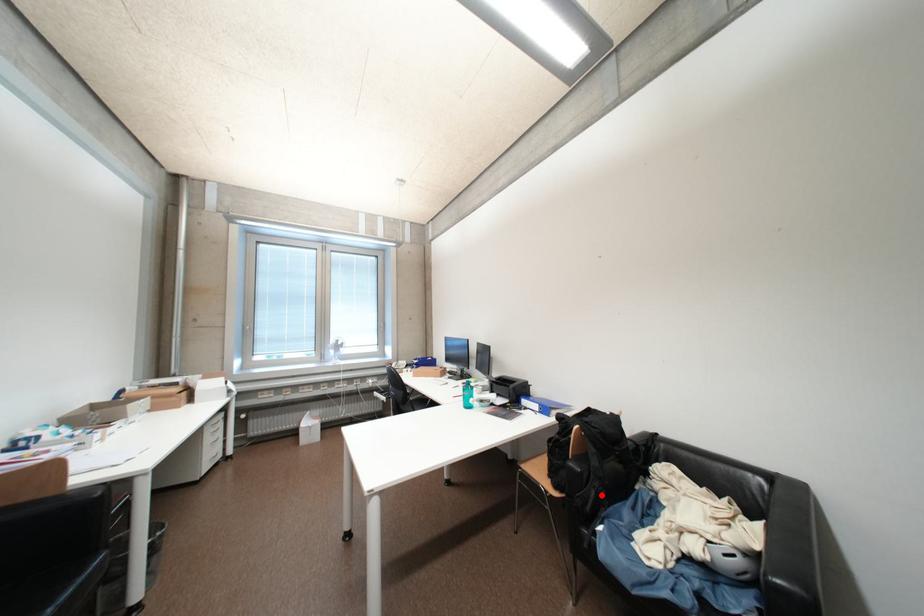
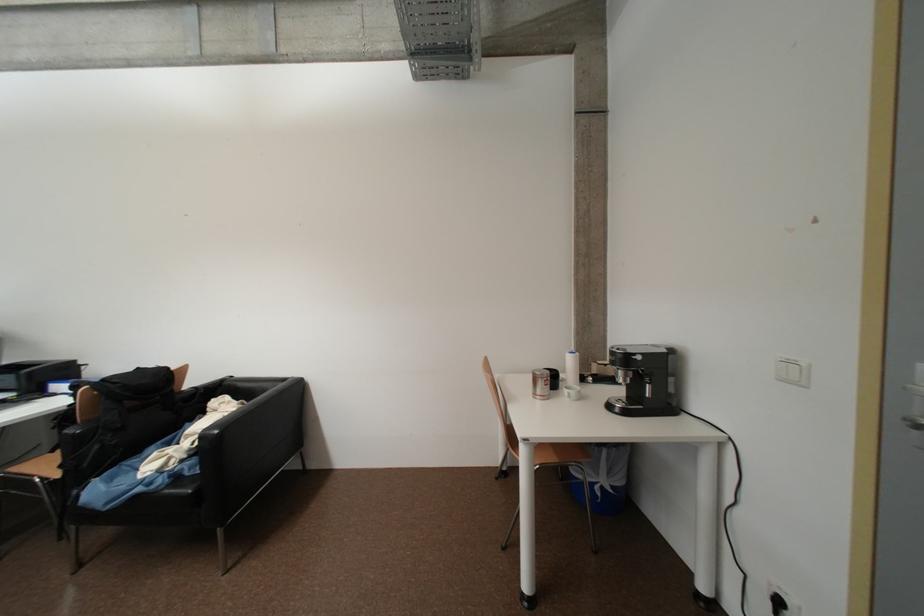
Question: I am providing you with two images of the same scene from different viewpoints. In image1, a red point is highlighted. Considering the same 3D point in image2, which of the following is correct?

Choices:
 (A) It is closer
 (B) It is farther

Answer: (A)